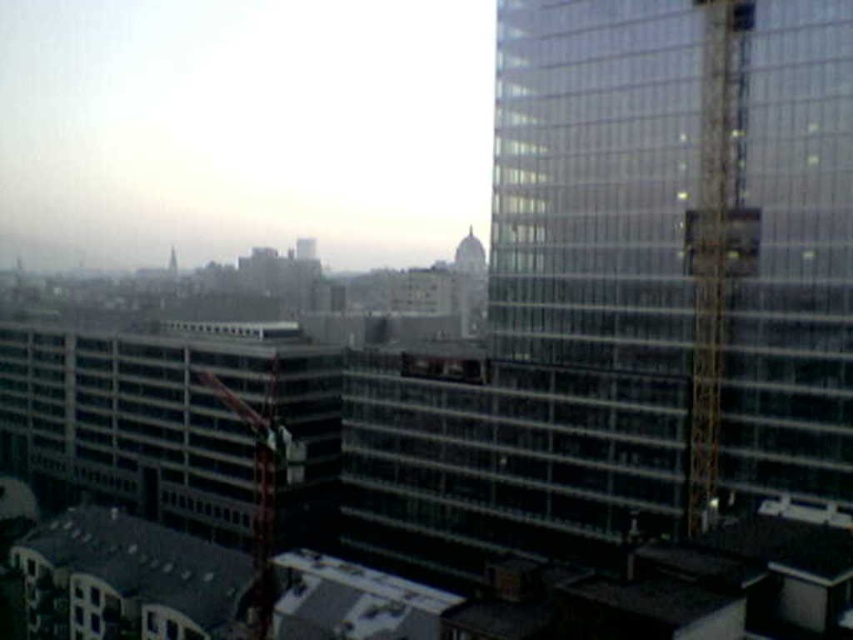
You are standing in the urban landscape and want to determine which of the two points, point (698, 260) or point (273, 596), is closer to you. Based on the scene description, which point is nearer?

Point (698, 260) is further to the viewer than point (273, 596), so the point closer to you is point (273, 596).